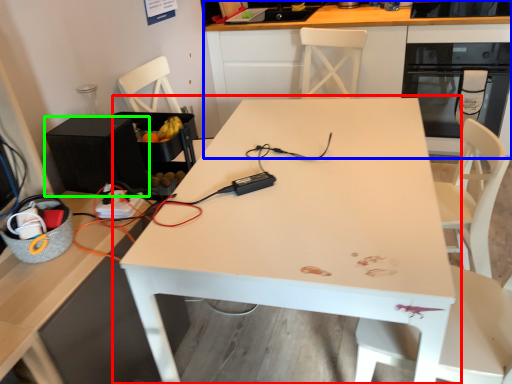
Question: Which object is positioned closest to table (highlighted by a red box)? Select from cabinetry (highlighted by a blue box) and appliance (highlighted by a green box).

Choices:
 (A) cabinetry
 (B) appliance

Answer: (B)